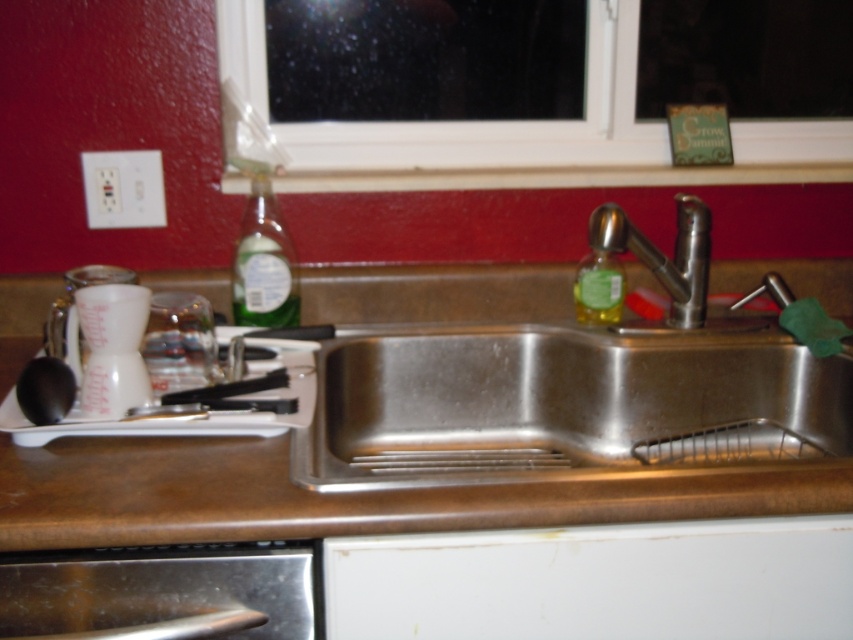
You are standing in the kitchen sink area and want to reach the white plastic window at upper center to clean it. Considering your arm can extend 2.5 feet, can you reach the window without moving closer?

The white plastic window at upper center is 4.27 feet away from you. Since your arm can only extend 2.5 feet, you cannot reach the window without moving closer.

Please provide the 2D coordinates of the stainless steel sink at center in the image. The coordinates should be in the format of a point with two decimal places, such as 0.5,0.5. The answer should be in the form of a point like 0.637,0.658. Please do not add any other information besides the coordinates.

The 2D coordinates of the stainless steel sink at center are (560, 406).

You are a kitchen assistant who needs to reach both the stainless steel sink at center and the translucent green liquid at sink left. If your arm can extend 14 inches, will you be able to reach both items without moving your body?

The distance between the stainless steel sink at center and the translucent green liquid at sink left is 15.22 inches. Since your arm can only extend 14 inches, you will not be able to reach both items without moving your body.